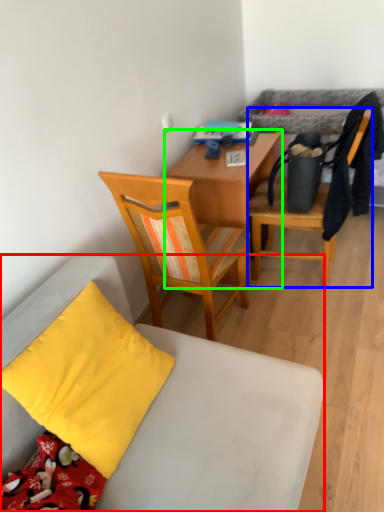
Question: Estimate the real-world distances between objects in this image. Which object is closer to chair (highlighted by a red box), chair (highlighted by a blue box) or desk (highlighted by a green box)?

Choices:
 (A) chair
 (B) desk

Answer: (B)